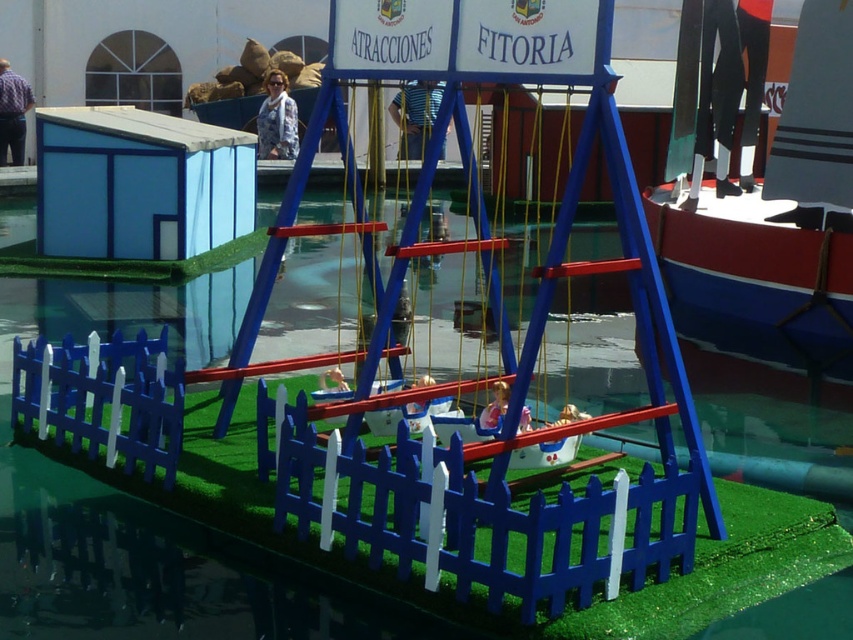
Does point (299, 484) lie behind point (469, 241)?

That is False.

Between blue painted wood picket fence at center and matte blue swing at center, which one has less height?

Standing shorter between the two is blue painted wood picket fence at center.

Where is `blue painted wood picket fence at center`? blue painted wood picket fence at center is located at coordinates [480, 508].

In the scene shown: Is blue painted wood picket fence at center thinner than red and blue painted wooden boat at right?

No, blue painted wood picket fence at center is not thinner than red and blue painted wooden boat at right.

You are a GUI agent. You are given a task and a screenshot of the screen. Output one action in this format:
    pyautogui.click(x=<x>, y=<y>)
    Task: Click on the blue painted wood picket fence at center
    
    Given the screenshot: What is the action you would take?
    pyautogui.click(x=480, y=508)

Which of these two, red and blue painted wooden boat at right or matte blue swing at center, stands taller?

Standing taller between the two is red and blue painted wooden boat at right.

Between point (843, 145) and point (494, 304), which one is positioned in front?

Point (494, 304) is in front.

The height and width of the screenshot is (640, 853). What are the coordinates of `red and blue painted wooden boat at right` in the screenshot? It's located at (778, 225).